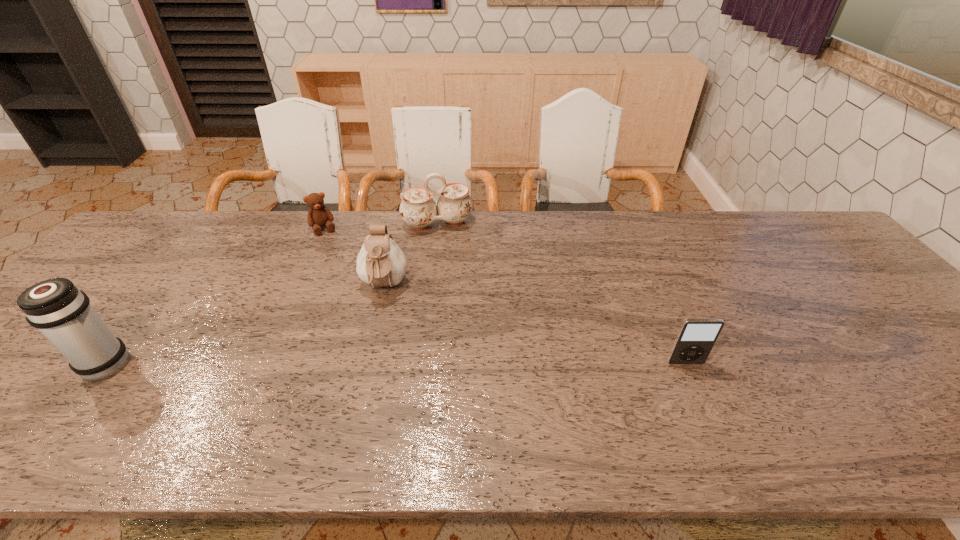
I want to click on the leftmost object, so click(60, 311).

Where is `the tallest object`? The height and width of the screenshot is (540, 960). the tallest object is located at coordinates (60, 311).

This screenshot has width=960, height=540. Find the location of `the second shortest object`. the second shortest object is located at coordinates 696,337.

Locate an element on the screen. The width and height of the screenshot is (960, 540). iPod is located at coordinates (696, 337).

This screenshot has width=960, height=540. Find the location of `teddy bear`. teddy bear is located at coordinates (319, 215).

Where is `the fourth object from right to left`? The image size is (960, 540). the fourth object from right to left is located at coordinates (319, 215).

Identify the location of pouch. Image resolution: width=960 pixels, height=540 pixels. (380, 262).

Where is `chinaware`? chinaware is located at coordinates (418, 209).

In order to click on free space located 0.050m on the side with the handle of the thermos bottle in this screenshot , I will do `click(55, 365)`.

You are a GUI agent. You are given a task and a screenshot of the screen. Output one action in this format:
    pyautogui.click(x=<x>, y=<y>)
    Task: Click on the vacant space situated 0.070m on the side with the handle of the thermos bottle
    The width and height of the screenshot is (960, 540).
    Given the screenshot: What is the action you would take?
    pyautogui.click(x=46, y=365)